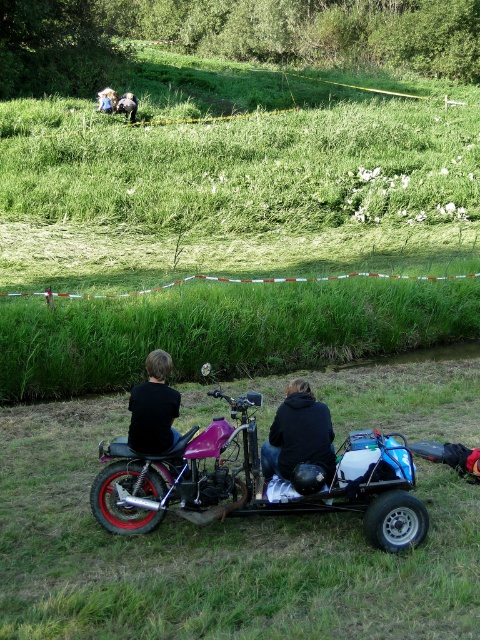
Question: Can you confirm if black matte shirt at center is wider than fluffy white dog at upper center?

Choices:
 (A) yes
 (B) no

Answer: (B)

Question: Which object appears farthest from the camera in this image?

Choices:
 (A) black matte shirt at center
 (B) green grass at lower center
 (C) shiny purple motorcycle at center

Answer: (A)

Question: Observing the image, what is the correct spatial positioning of shiny purple motorcycle at center in reference to black matte shirt at center?

Choices:
 (A) below
 (B) above

Answer: (A)

Question: Among these objects, which one is farthest from the camera?

Choices:
 (A) black matte shirt at center
 (B) shiny purple motorcycle at center

Answer: (A)

Question: Considering the relative positions of black matte jacket at center and fluffy white dog at upper center in the image provided, where is black matte jacket at center located with respect to fluffy white dog at upper center?

Choices:
 (A) above
 (B) below

Answer: (B)

Question: Considering the real-world distances, which object is closest to the black matte shirt at center?

Choices:
 (A) shiny purple motorcycle at center
 (B) black matte jacket at center
 (C) fluffy white dog at upper center
 (D) green grass at lower center

Answer: (A)